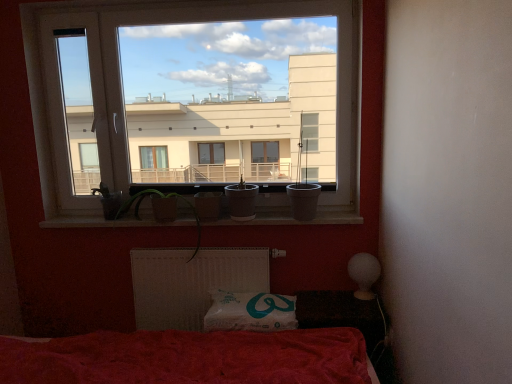
Question: Visually, is smooth concrete window sill at center positioned to the left or to the right of transparent glass window at upper center?

Choices:
 (A) left
 (B) right

Answer: (B)

Question: In terms of height, does smooth concrete window sill at center look taller or shorter compared to transparent glass window at upper center?

Choices:
 (A) short
 (B) tall

Answer: (A)

Question: Estimate the real-world distances between objects in this image. Which object is farther from the green matte plant at center?

Choices:
 (A) white fabric pillow at lower center
 (B) smooth concrete window sill at center
 (C) white textured radiator at lower center
 (D) matte white pot at center
 (E) red fabric bed at lower left

Answer: (A)

Question: Which object is the farthest from the red fabric bed at lower left?

Choices:
 (A) transparent glass window at upper center
 (B) smooth concrete window sill at center
 (C) matte white pot at center
 (D) white textured radiator at lower center
 (E) green matte plant at center

Answer: (A)